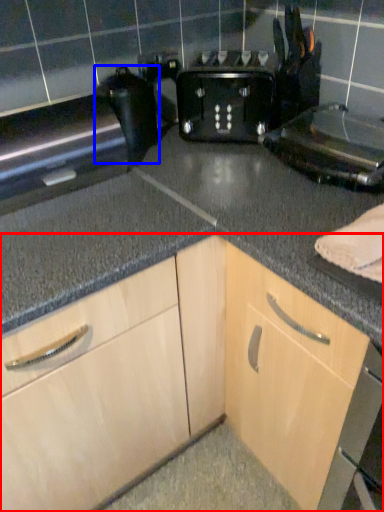
Question: Among these objects, which one is farthest to the camera, cabinetry (highlighted by a red box) or appliance (highlighted by a blue box)?

Choices:
 (A) cabinetry
 (B) appliance

Answer: (B)